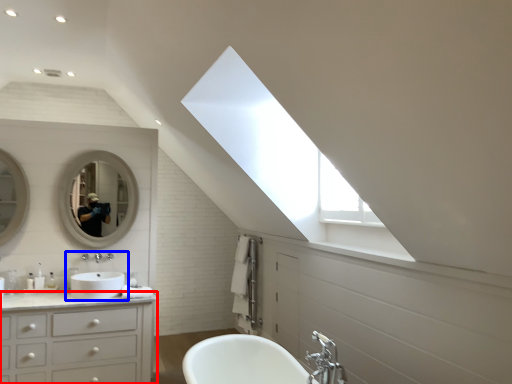
Question: Which object appears closest to the camera in this image, bathroom cabinet (highlighted by a red box) or sink (highlighted by a blue box)?

Choices:
 (A) bathroom cabinet
 (B) sink

Answer: (A)